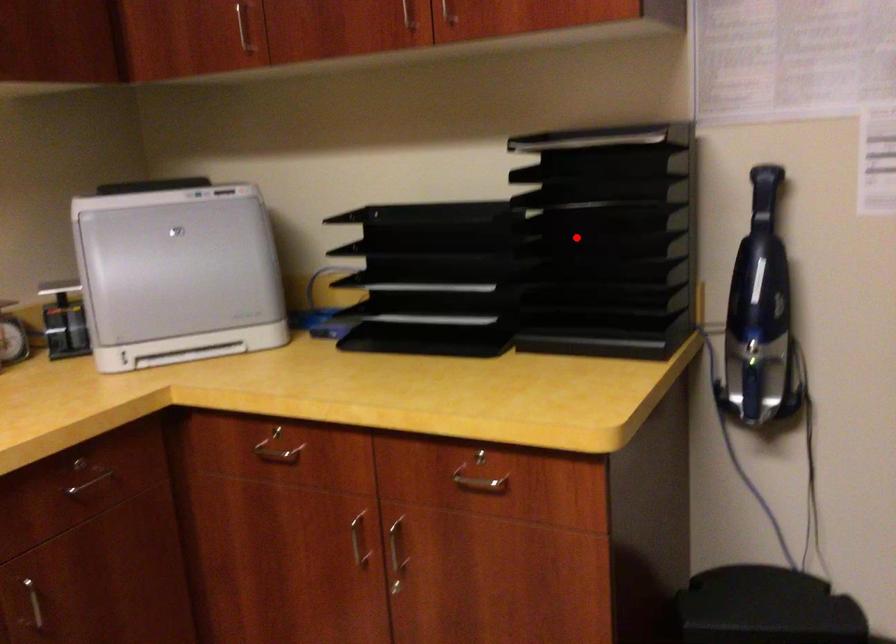
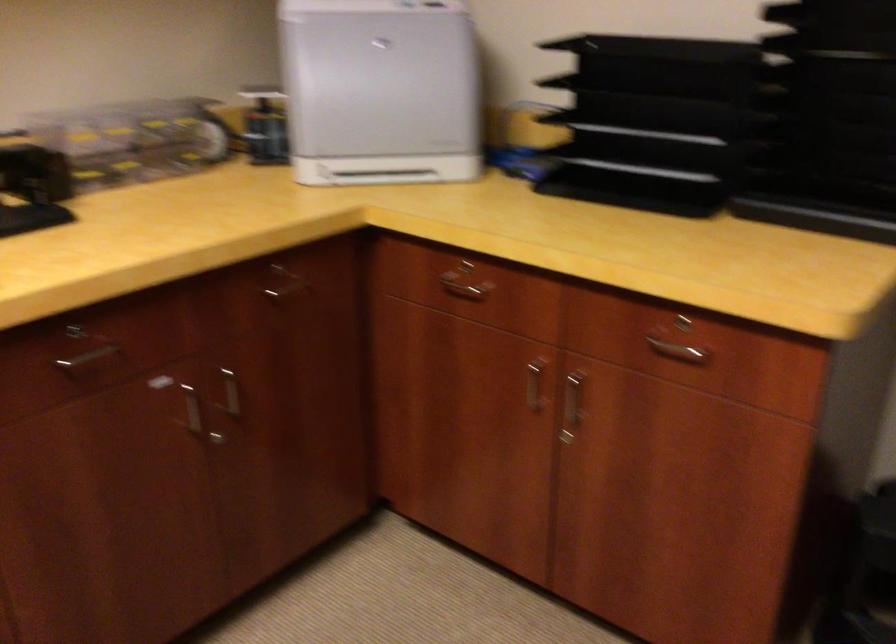
Find the pixel in the second image that matches the highlighted location in the first image.

(823, 93)